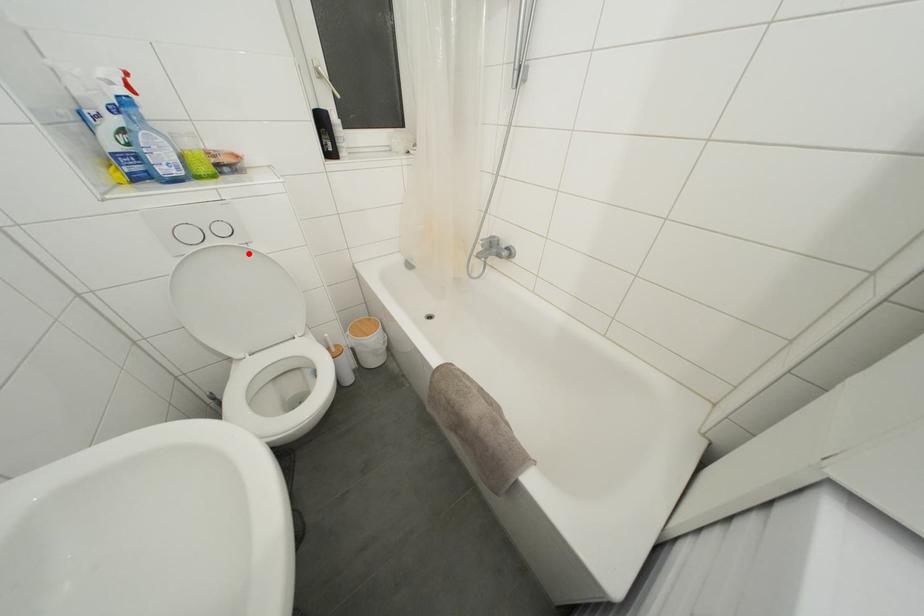
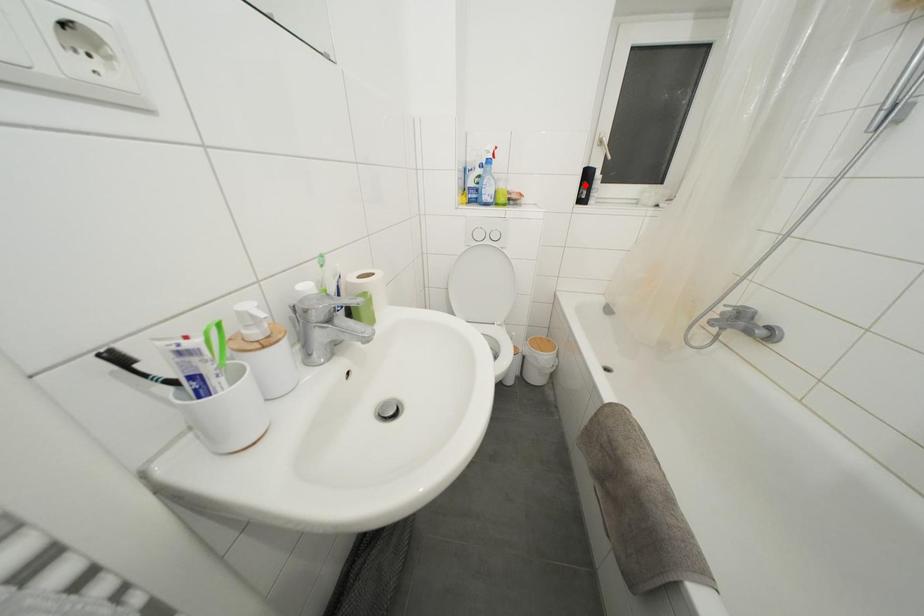
I am providing you with two images of the same scene from different viewpoints. A red point is marked on the first image and another point is marked on the second image. Is the marked point in image1 the same physical position as the marked point in image2?

No